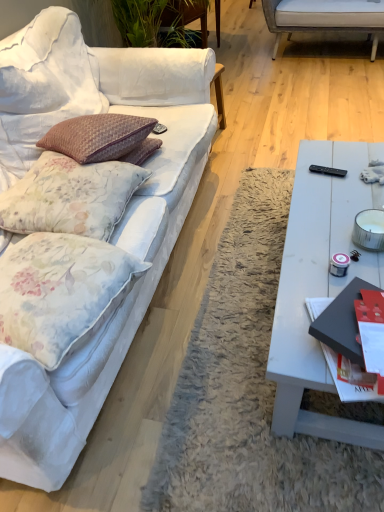
Measure the distance between black plastic remote control at right and camera.

The distance of black plastic remote control at right from camera is 1.61 meters.

Measure the distance between point (13, 253) and camera.

Point (13, 253) is 4.06 feet from camera.

You are a GUI agent. You are given a task and a screenshot of the screen. Output one action in this format:
    pyautogui.click(x=<x>, y=<y>)
    Task: Click on the red glossy magazine at right
    The image size is (384, 512).
    Given the screenshot: What is the action you would take?
    pyautogui.click(x=342, y=342)

At what (x,y) coordinates should I click in order to perform the action: click on white fabric couch at left. Please return your answer as a coordinate pair (x, y). Image resolution: width=384 pixels, height=512 pixels. Looking at the image, I should click on (121, 247).

The height and width of the screenshot is (512, 384). What do you see at coordinates (319, 283) in the screenshot?
I see `white matte coffee table at right` at bounding box center [319, 283].

Identify the location of black plastic remote control at right. (328, 170).

Are white matte coffee table at right and floral fabric pillow at left, which ranks as the 2th pillow in bottom-to-top order, beside each other?

They are not placed beside each other.

Find the location of a particular element. pillow that appears above the white matte coffee table at right (from the image's perspective) is located at coordinates (70, 197).

Considering the positions of points (342, 224) and (57, 210), is point (342, 224) closer to camera compared to point (57, 210)?

No, it is not.

Which of these two, floral fabric pillow at left, which ranks as the 2th pillow in bottom-to-top order, or white matte coffee table at right, is bigger?

Bigger between the two is white matte coffee table at right.

Is floral fabric pillow at left, which ranks as the 2th pillow in bottom-to-top order, completely or partially outside of white matte coffee table at right?

Absolutely, floral fabric pillow at left, which ranks as the 2th pillow in bottom-to-top order, is external to white matte coffee table at right.

The image size is (384, 512). I want to click on pillow above the white matte coffee table at right (from the image's perspective), so click(x=70, y=197).

From the image's perspective, is floral fabric pillow at left, acting as the first pillow starting from the top, positioned above or below white matte coffee table at right?

From the image's perspective, floral fabric pillow at left, acting as the first pillow starting from the top, appears above white matte coffee table at right.

Who is more distant, black plastic remote control at right or white fabric couch at left?

black plastic remote control at right.

Is black plastic remote control at right at the left side of white fabric couch at left?

Incorrect, black plastic remote control at right is not on the left side of white fabric couch at left.

In the scene shown: Considering the sizes of black plastic remote control at right and white fabric couch at left in the image, is black plastic remote control at right taller or shorter than white fabric couch at left?

In the image, black plastic remote control at right appears to be shorter than white fabric couch at left.

You are a GUI agent. You are given a task and a screenshot of the screen. Output one action in this format:
    pyautogui.click(x=<x>, y=<y>)
    Task: Click on the remote control behind the white fabric couch at left
    The image size is (384, 512).
    Given the screenshot: What is the action you would take?
    pyautogui.click(x=328, y=170)

From a real-world perspective, is white fabric couch at left on black plastic remote control at right?

Yes, from a real-world perspective, white fabric couch at left is over black plastic remote control at right

Which is correct: white fabric couch at left is inside black plastic remote control at right, or outside of it?

white fabric couch at left is outside black plastic remote control at right.

Is white fabric couch at left not close to black plastic remote control at right?

Actually, white fabric couch at left and black plastic remote control at right are a little close together.

Does red glossy magazine at right appear on the left side of black plastic remote control at right?

Correct, you'll find red glossy magazine at right to the left of black plastic remote control at right.

From the image's perspective, is red glossy magazine at right positioned above or below black plastic remote control at right?

Based on their image positions, red glossy magazine at right is located beneath black plastic remote control at right.

Is red glossy magazine at right placed right next to black plastic remote control at right?

They are not placed beside each other.

How different are the orientations of red glossy magazine at right and black plastic remote control at right in degrees?

101 degrees.

Is floral fabric pillow at left, acting as the second pillow starting from the top, oriented away from white fabric couch at left?

Absolutely, floral fabric pillow at left, acting as the second pillow starting from the top, is directed away from white fabric couch at left.

Locate an element on the screen. the 1st pillow located above the white fabric couch at left (from a real-world perspective) is located at coordinates (61, 292).

How different are the orientations of floral fabric pillow at left, which is the first pillow from bottom to top, and white fabric couch at left in degrees?

The angular difference between floral fabric pillow at left, which is the first pillow from bottom to top, and white fabric couch at left is 11.6 degrees.

Considering the positions of objects floral fabric pillow at left, acting as the second pillow starting from the top, and white fabric couch at left in the image provided, who is more to the left, floral fabric pillow at left, acting as the second pillow starting from the top, or white fabric couch at left?

white fabric couch at left is more to the left.

From the image's perspective, relative to floral fabric pillow at left, which ranks as the 2th pillow in bottom-to-top order, is red glossy magazine at right above or below?

Based on their image positions, red glossy magazine at right is located beneath floral fabric pillow at left, which ranks as the 2th pillow in bottom-to-top order.

Considering the points (347, 290) and (36, 167), which point is behind, point (347, 290) or point (36, 167)?

The point (36, 167) is farther from the camera.

Is red glossy magazine at right in front of or behind floral fabric pillow at left, acting as the first pillow starting from the top, in the image?

red glossy magazine at right is in front of floral fabric pillow at left, acting as the first pillow starting from the top.

Is floral fabric pillow at left, which ranks as the 2th pillow in bottom-to-top order, completely or partially inside red glossy magazine at right?

No.

Locate an element on the screen. coffee table that appears below the floral fabric pillow at left, acting as the first pillow starting from the top (from the image's perspective) is located at coordinates (319, 283).

The width and height of the screenshot is (384, 512). I want to click on the 2nd pillow to the left of the white matte coffee table at right, starting your count from the anchor, so click(70, 197).

Considering their positions, is black plastic remote control at right positioned further to white matte coffee table at right than floral fabric pillow at left, which ranks as the 2th pillow in bottom-to-top order?

floral fabric pillow at left, which ranks as the 2th pillow in bottom-to-top order, is further to white matte coffee table at right.

Looking at the image, which one is located further to floral fabric pillow at left, which ranks as the 2th pillow in bottom-to-top order, floral fabric pillow at left, which is the first pillow from bottom to top, or red glossy magazine at right?

red glossy magazine at right.

Estimate the real-world distances between objects in this image. Which object is closer to white matte coffee table at right, red glossy magazine at right or floral fabric pillow at left, acting as the first pillow starting from the top?

red glossy magazine at right is closer to white matte coffee table at right.

Considering their positions, is floral fabric pillow at left, which is the first pillow from bottom to top, positioned further to floral fabric pillow at left, acting as the first pillow starting from the top, than black plastic remote control at right?

black plastic remote control at right lies further to floral fabric pillow at left, acting as the first pillow starting from the top, than the other object.

Looking at the image, which one is located closer to floral fabric pillow at left, which ranks as the 2th pillow in bottom-to-top order, white fabric couch at left or black plastic remote control at right?

white fabric couch at left lies closer to floral fabric pillow at left, which ranks as the 2th pillow in bottom-to-top order, than the other object.

Which object lies further to the anchor point white matte coffee table at right, floral fabric pillow at left, acting as the second pillow starting from the top, or black plastic remote control at right?

floral fabric pillow at left, acting as the second pillow starting from the top.

In the scene shown: From the image, which object appears to be farther from red glossy magazine at right, floral fabric pillow at left, which is the first pillow from bottom to top, or floral fabric pillow at left, which ranks as the 2th pillow in bottom-to-top order?

floral fabric pillow at left, which ranks as the 2th pillow in bottom-to-top order, is further to red glossy magazine at right.

Estimate the real-world distances between objects in this image. Which object is closer to floral fabric pillow at left, acting as the second pillow starting from the top, floral fabric pillow at left, which ranks as the 2th pillow in bottom-to-top order, or red glossy magazine at right?

Based on the image, floral fabric pillow at left, which ranks as the 2th pillow in bottom-to-top order, appears to be nearer to floral fabric pillow at left, acting as the second pillow starting from the top.

This screenshot has height=512, width=384. I want to click on magazine between white fabric couch at left and white matte coffee table at right in the horizontal direction, so click(342, 342).

At what (x,y) coordinates should I click in order to perform the action: click on remote control situated between white fabric couch at left and white matte coffee table at right from left to right. Please return your answer as a coordinate pair (x, y). This screenshot has height=512, width=384. Looking at the image, I should click on (328, 170).

The height and width of the screenshot is (512, 384). I want to click on coffee table located between red glossy magazine at right and black plastic remote control at right in the depth direction, so click(x=319, y=283).

The image size is (384, 512). In order to click on magazine between floral fabric pillow at left, acting as the second pillow starting from the top, and black plastic remote control at right from left to right in this screenshot , I will do `click(342, 342)`.